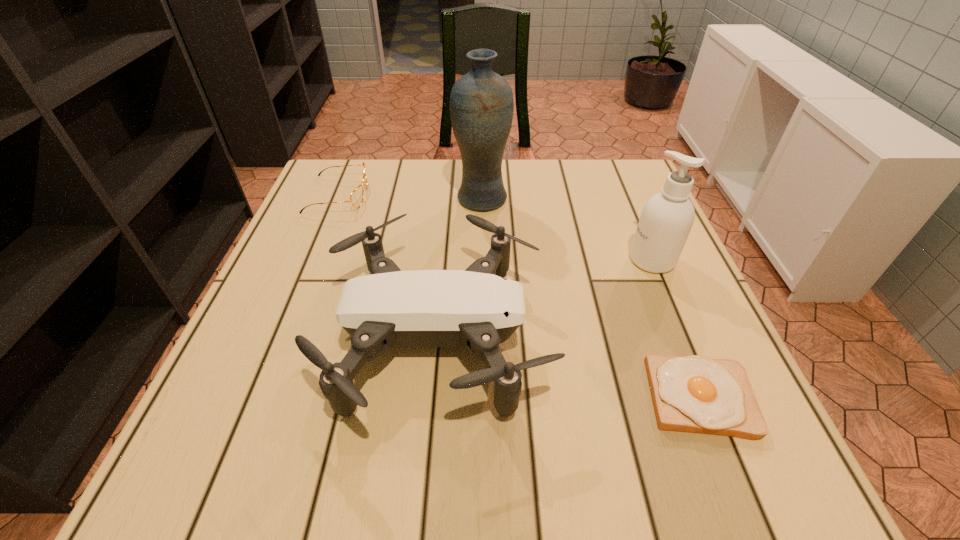
Identify the location of object located in the far left corner section of the desktop. (356, 198).

I want to click on object that is positioned at the near right corner, so click(695, 394).

In the image, there is a desktop. Where is `vacant space at the far edge`? vacant space at the far edge is located at coordinates (503, 163).

This screenshot has height=540, width=960. Find the location of `blank space at the near edge of the desktop`. blank space at the near edge of the desktop is located at coordinates (544, 473).

In the image, there is a desktop. At what (x,y) coordinates should I click in order to perform the action: click on vacant space at the left edge. Please return your answer as a coordinate pair (x, y). Image resolution: width=960 pixels, height=540 pixels. Looking at the image, I should click on (224, 418).

This screenshot has height=540, width=960. Identify the location of vacant region at the right edge. (626, 232).

Locate an element on the screen. This screenshot has height=540, width=960. free space at the far left corner of the desktop is located at coordinates (354, 170).

What are the coordinates of `vacant space at the far right corner of the desktop` in the screenshot? It's located at (629, 177).

You are a GUI agent. You are given a task and a screenshot of the screen. Output one action in this format:
    pyautogui.click(x=<x>, y=<y>)
    Task: Click on the vacant space that's between the third shortest object and the toast
    
    Given the screenshot: What is the action you would take?
    [569, 367]

Find the location of a particular element. This screenshot has width=960, height=540. free point between the fourth tallest object and the vase is located at coordinates (410, 197).